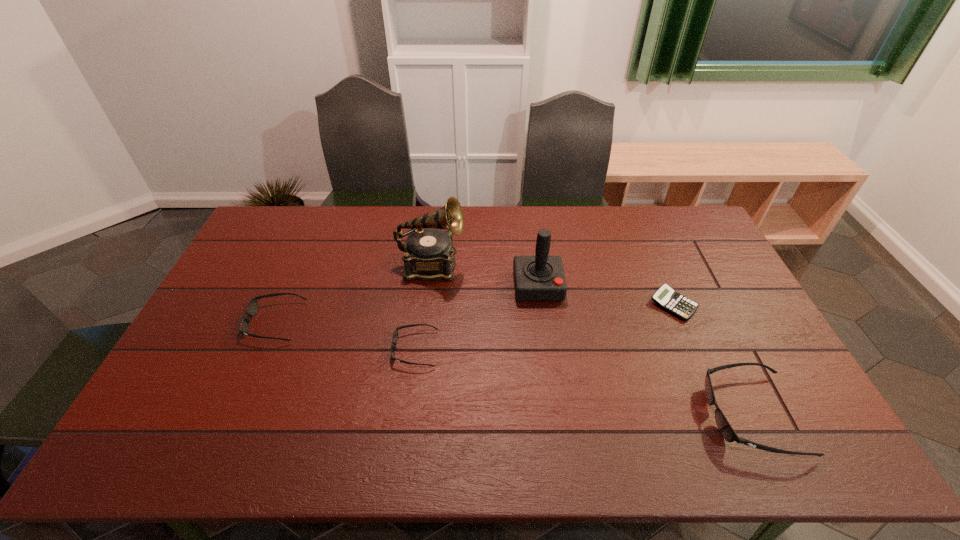
In order to click on the third shortest object in this screenshot , I will do `click(252, 308)`.

Identify the location of the leftmost sunglasses. (252, 308).

At what (x,y) coordinates should I click in order to perform the action: click on the second sunglasses from right to left. Please return your answer as a coordinate pair (x, y). The width and height of the screenshot is (960, 540). Looking at the image, I should click on (395, 335).

The width and height of the screenshot is (960, 540). Find the location of `the fifth tallest object`. the fifth tallest object is located at coordinates (395, 335).

Where is `the rightmost sunglasses`? the rightmost sunglasses is located at coordinates (726, 430).

This screenshot has height=540, width=960. Find the location of `the nearest sunglasses`. the nearest sunglasses is located at coordinates (726, 430).

Image resolution: width=960 pixels, height=540 pixels. Find the location of `the third object from right to left`. the third object from right to left is located at coordinates (541, 277).

The height and width of the screenshot is (540, 960). Find the location of `the second tallest object`. the second tallest object is located at coordinates (541, 277).

What are the coordinates of `calculator` in the screenshot? It's located at (665, 297).

The image size is (960, 540). What are the coordinates of `phonograph record` in the screenshot? It's located at (429, 253).